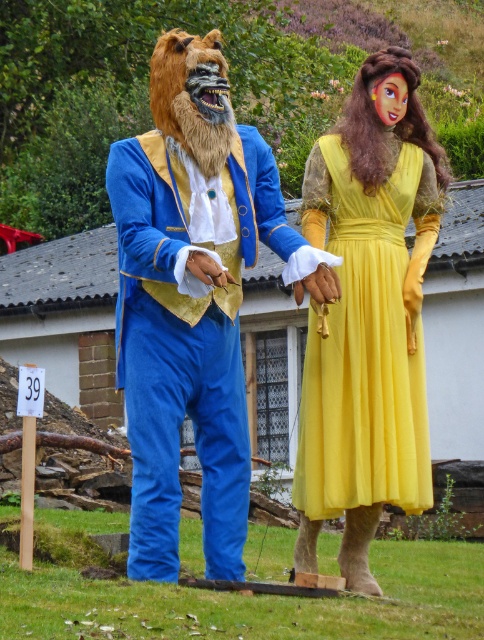
Question: Which point is farther to the camera?

Choices:
 (A) yellow satin dress at center
 (B) velvet blue suit at left

Answer: (A)

Question: Does velvet blue suit at left lie behind yellow satin dress at center?

Choices:
 (A) no
 (B) yes

Answer: (A)

Question: Among these objects, which one is nearest to the camera?

Choices:
 (A) velvet blue suit at left
 (B) yellow satin dress at center

Answer: (A)

Question: Is velvet blue suit at left positioned behind yellow satin dress at center?

Choices:
 (A) no
 (B) yes

Answer: (A)

Question: Is velvet blue suit at left positioned behind yellow satin dress at center?

Choices:
 (A) yes
 (B) no

Answer: (B)